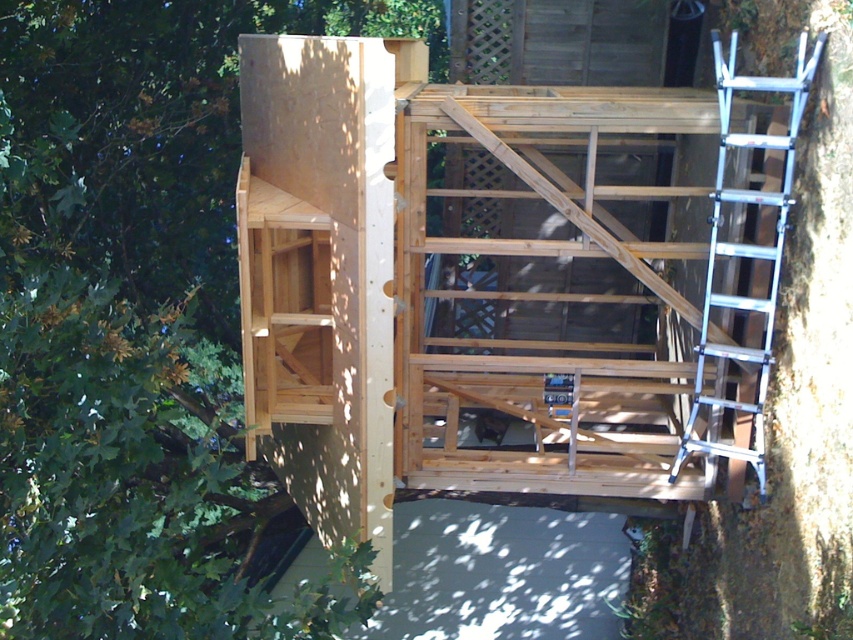
You are a painter who needs to decide which object to paint first. The green matte tree at upper left and the silver metallic ladder at right are both in your view. Based on their sizes, which object should you choose if you want to paint the larger one first?

The green matte tree at upper left is larger in size than the silver metallic ladder at right, so you should paint the green matte tree at upper left first.

You are a construction worker who needs to move a heavy tool from the green matte tree at upper left to the silver metallic ladder at right. Can you move it directly without going around any obstacles?

The green matte tree at upper left is to the left of the silver metallic ladder at right, so there are no obstacles blocking the direct path between them. You can move the tool directly.

You are standing at the base of the structure and want to move towards the green matte tree at upper left without passing through the silver metallic ladder at right. Is there a clear path available?

The green matte tree at upper left is located below the silver metallic ladder at right, so you can move towards the green matte tree at upper left by going around the ladder since it is positioned below the ladder.